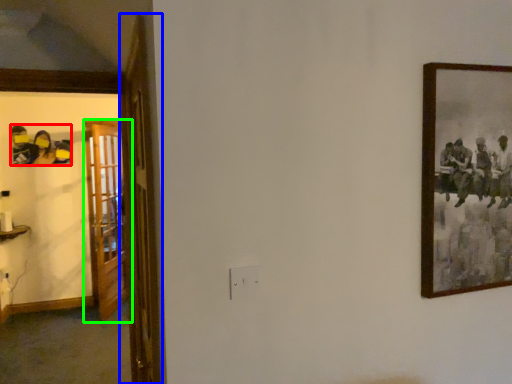
Question: Which is farther away from art (highlighted by a red box)? door (highlighted by a blue box) or door (highlighted by a green box)?

Choices:
 (A) door
 (B) door

Answer: (A)